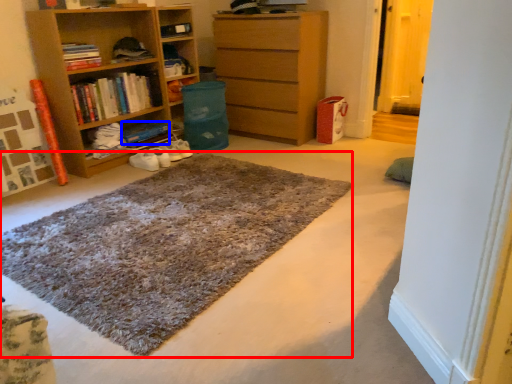
Question: Which object is further to the camera taking this photo, doormat (highlighted by a red box) or book (highlighted by a blue box)?

Choices:
 (A) doormat
 (B) book

Answer: (B)